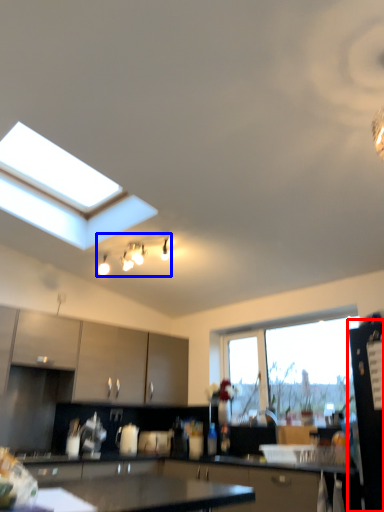
Question: Which of the following is the farthest to the observer, appliance (highlighted by a red box) or light fixture (highlighted by a blue box)?

Choices:
 (A) appliance
 (B) light fixture

Answer: (B)